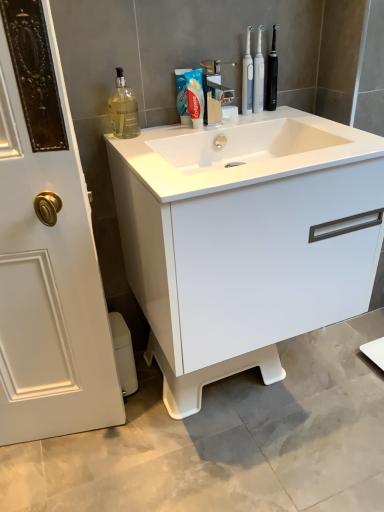
Question: Is translucent glass bottle at upper left completely or partially inside white plastic toilet bowl at lower left?

Choices:
 (A) yes
 (B) no

Answer: (B)

Question: Is white plastic toilet bowl at lower left at the left side of translucent glass bottle at upper left?

Choices:
 (A) yes
 (B) no

Answer: (A)

Question: Does white plastic toilet bowl at lower left have a lesser height compared to translucent glass bottle at upper left?

Choices:
 (A) yes
 (B) no

Answer: (B)

Question: Could you tell me if white plastic toilet bowl at lower left is turned towards translucent glass bottle at upper left?

Choices:
 (A) yes
 (B) no

Answer: (B)

Question: Is white plastic toilet bowl at lower left not close to translucent glass bottle at upper left?

Choices:
 (A) yes
 (B) no

Answer: (B)

Question: Considering the relative sizes of white plastic toilet bowl at lower left and translucent glass bottle at upper left in the image provided, is white plastic toilet bowl at lower left smaller than translucent glass bottle at upper left?

Choices:
 (A) yes
 (B) no

Answer: (B)

Question: From a real-world perspective, is clear plastic toothbrushes at upper center on top of white matte toothpaste at center?

Choices:
 (A) yes
 (B) no

Answer: (A)

Question: Can white matte toothpaste at center be found inside clear plastic toothbrushes at upper center?

Choices:
 (A) yes
 (B) no

Answer: (B)

Question: From the image's perspective, is clear plastic toothbrushes at upper center located beneath white matte toothpaste at center?

Choices:
 (A) yes
 (B) no

Answer: (B)

Question: Would you consider clear plastic toothbrushes at upper center to be distant from white matte toothpaste at center?

Choices:
 (A) yes
 (B) no

Answer: (B)

Question: Can you confirm if clear plastic toothbrushes at upper center is wider than white matte toothpaste at center?

Choices:
 (A) yes
 (B) no

Answer: (B)

Question: From a real-world perspective, is clear plastic toothbrushes at upper center under white matte toothpaste at center?

Choices:
 (A) yes
 (B) no

Answer: (B)

Question: Is black plastic toothbrush at upper right, placed as the 2th toiletry when sorted from left to right, in contact with white plastic toilet bowl at lower left?

Choices:
 (A) yes
 (B) no

Answer: (B)